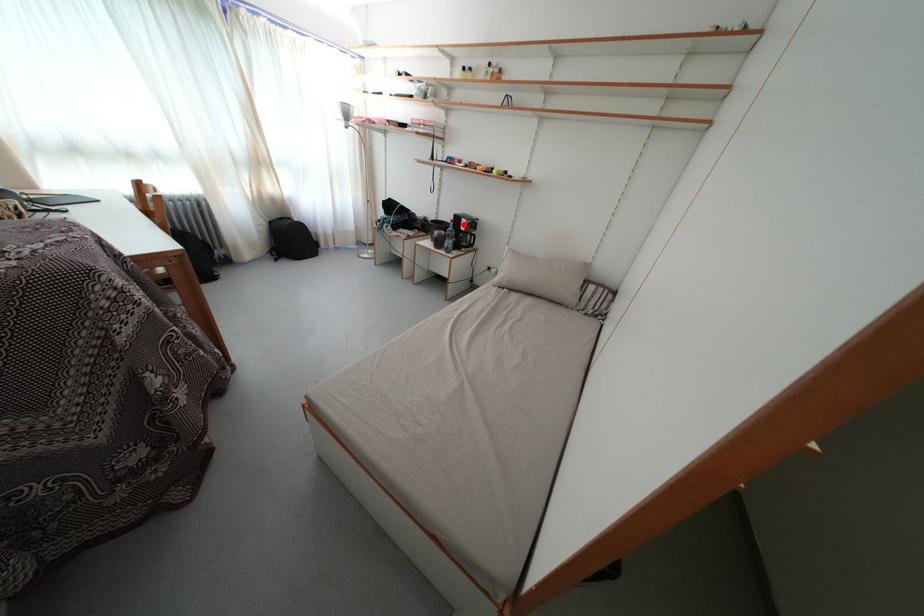
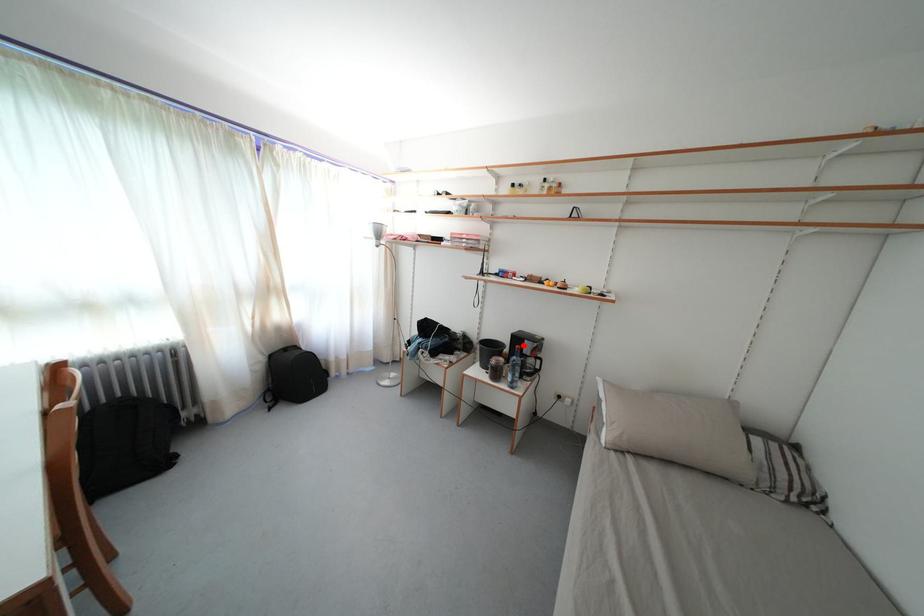
I am providing you with two images of the same scene from different viewpoints. A red point is marked on the first image and another point is marked on the second image. Are the points marked in image1 and image2 representing the same 3D position?

Yes